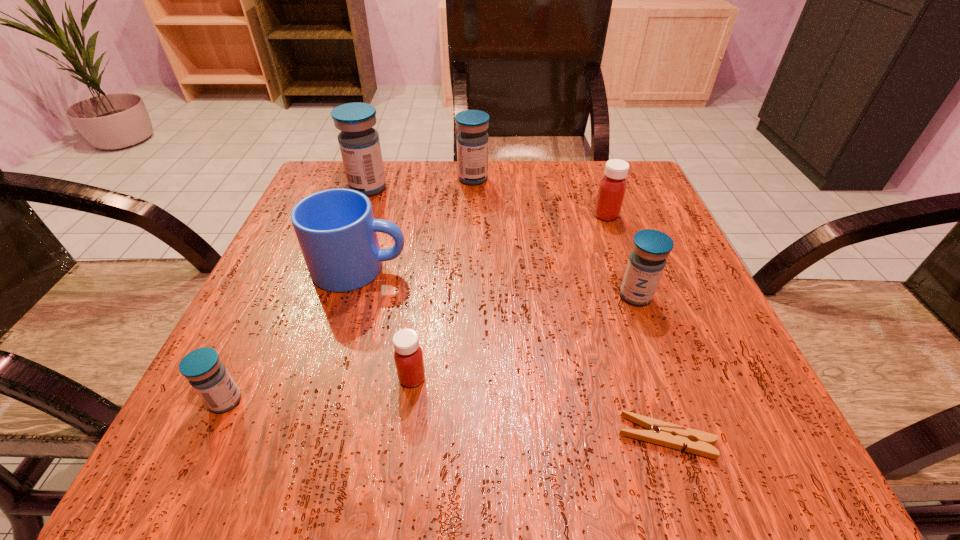
Identify the location of the fourth object from left to right. This screenshot has width=960, height=540. (408, 356).

Find the location of a particular element. The height and width of the screenshot is (540, 960). the smallest blue medicine is located at coordinates (209, 377).

Locate an element on the screen. the leftmost medicine is located at coordinates (209, 377).

What are the coordinates of `clothespin` in the screenshot? It's located at (662, 433).

Find the location of `the nearest object`. the nearest object is located at coordinates (662, 433).

Locate an element on the screen. This screenshot has width=960, height=540. vacant space positioned 0.250m on the front of the second blue medicine from left to right is located at coordinates (338, 275).

Where is `vacant space located on the left of the fourth medicine from left to right`? This screenshot has width=960, height=540. vacant space located on the left of the fourth medicine from left to right is located at coordinates (385, 179).

The height and width of the screenshot is (540, 960). Identify the location of vacant space located 0.090m on the side of the mug with the handle. (458, 268).

The width and height of the screenshot is (960, 540). Identify the location of vacant region located 0.150m on the front of the third nearest medicine. (668, 386).

Locate an element on the screen. vacant region located 0.220m on the left of the sixth nearest object is located at coordinates (490, 215).